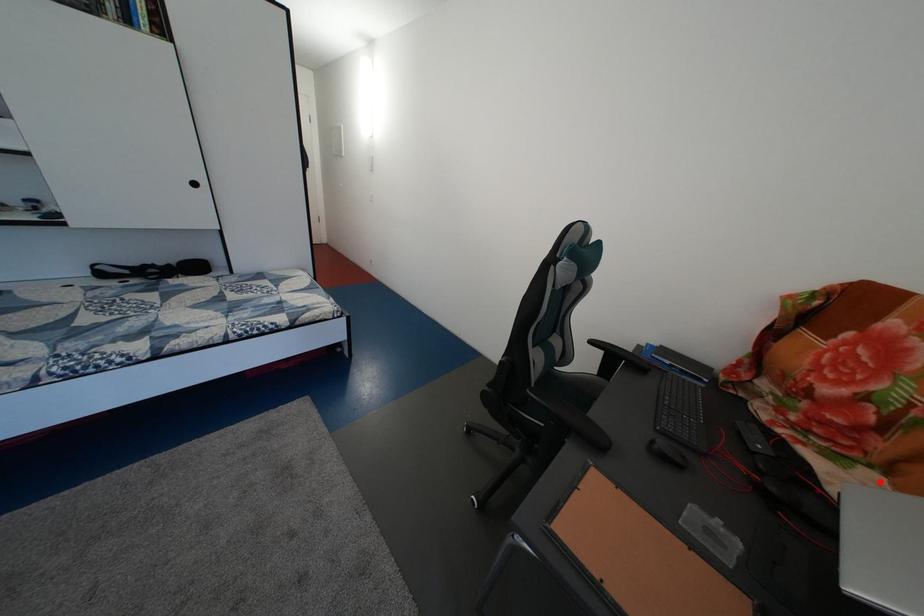
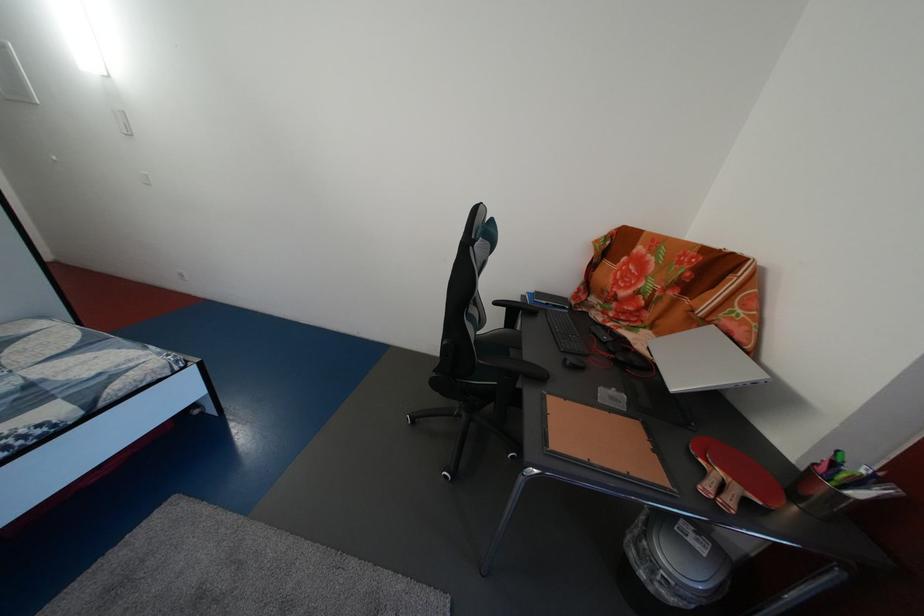
Question: I am providing you with two images of the same scene from different viewpoints. Image1 has a red point marked. In image2, the corresponding 3D location appears at what relative position? Reply with the corresponding letter.

Choices:
 (A) Closer
 (B) Farther

Answer: (A)